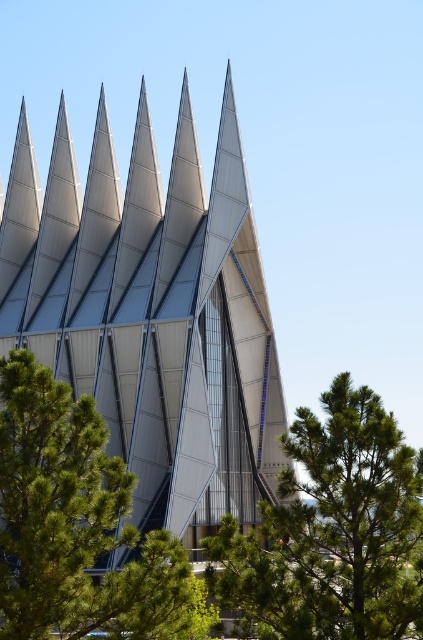
Is metallic glass spires at center positioned in front of green leafy tree at center?

No, metallic glass spires at center is further to the viewer.

In the scene shown: Can you confirm if metallic glass spires at center is positioned to the right of green leafy tree at center?

In fact, metallic glass spires at center is to the left of green leafy tree at center.

Find the location of `metallic glass spires at center`. metallic glass spires at center is located at coordinates (153, 312).

Can you confirm if green needle-like leaves at center is taller than green leafy tree at center?

In fact, green needle-like leaves at center may be shorter than green leafy tree at center.

Who is more forward, (288, 570) or (68, 420)?

Point (68, 420) is more forward.

Is point (313, 588) positioned behind point (57, 563)?

Yes.

You are a GUI agent. You are given a task and a screenshot of the screen. Output one action in this format:
    pyautogui.click(x=<x>, y=<y>)
    Task: Click on the green needle-like leaves at center
    This screenshot has height=640, width=423.
    Given the screenshot: What is the action you would take?
    pyautogui.click(x=332, y=531)

Does metallic glass spires at center have a smaller size compared to green needle-like leaves at center?

Incorrect, metallic glass spires at center is not smaller in size than green needle-like leaves at center.

Which of these two, metallic glass spires at center or green needle-like leaves at center, stands shorter?

green needle-like leaves at center is shorter.

Is point (252, 490) positioned behind point (304, 556)?

Yes, it is behind point (304, 556).

Identify the location of metallic glass spires at center. The height and width of the screenshot is (640, 423). (153, 312).